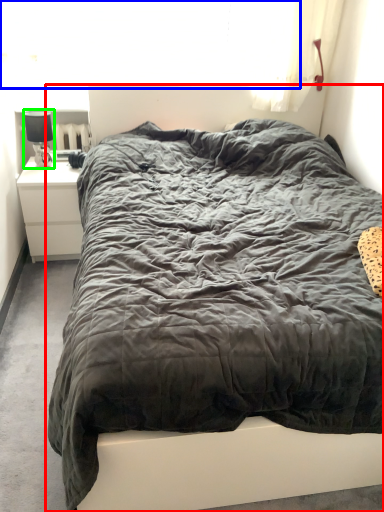
Question: Which object is positioned farthest from bed (highlighted by a red box)? Select from window screen (highlighted by a blue box) and lamp (highlighted by a green box).

Choices:
 (A) window screen
 (B) lamp

Answer: (B)